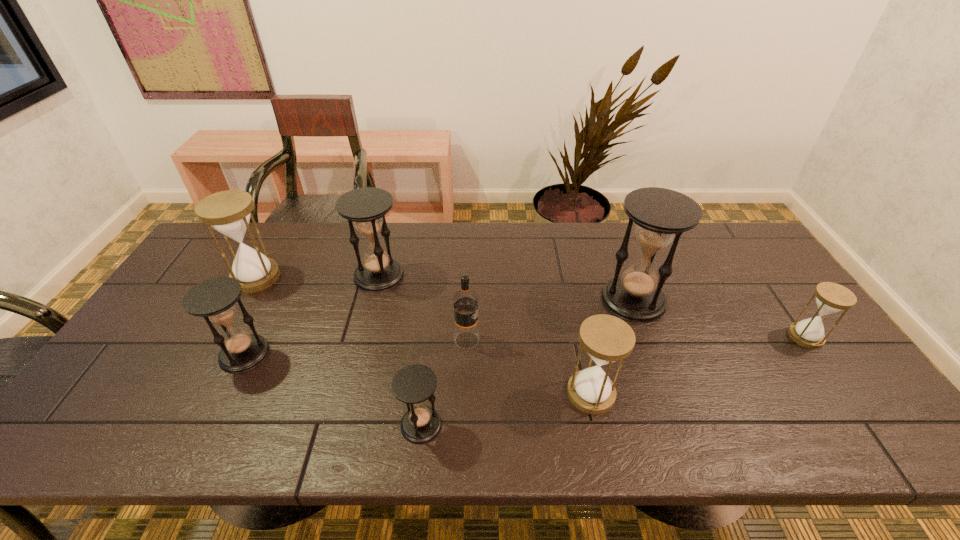
I want to click on free region at the far left corner, so click(x=204, y=254).

This screenshot has width=960, height=540. Find the location of `vacant space at the far right corner of the desktop`. vacant space at the far right corner of the desktop is located at coordinates coord(759,265).

Where is `vacant area that lies between the leftmost black hourglass and the smallest white hourglass`? The height and width of the screenshot is (540, 960). vacant area that lies between the leftmost black hourglass and the smallest white hourglass is located at coordinates (525, 346).

Where is `empty space that is in between the third smallest black hourglass and the tallest object`? The width and height of the screenshot is (960, 540). empty space that is in between the third smallest black hourglass and the tallest object is located at coordinates (506, 288).

You are a GUI agent. You are given a task and a screenshot of the screen. Output one action in this format:
    pyautogui.click(x=<x>, y=<y>)
    Task: Click on the free space that is in between the leftmost white hourglass and the fourth object from left to right
    
    Given the screenshot: What is the action you would take?
    pyautogui.click(x=339, y=351)

You are a GUI agent. You are given a task and a screenshot of the screen. Output one action in this format:
    pyautogui.click(x=<x>, y=<y>)
    Task: Click on the unoccupied area between the third black hourglass from left to right and the smallest white hourglass
    The image size is (960, 540).
    Given the screenshot: What is the action you would take?
    pyautogui.click(x=613, y=381)

Locate an element on the screen. The width and height of the screenshot is (960, 540). vacant space that is in between the nearest black hourglass and the leftmost white hourglass is located at coordinates (339, 351).

At what (x,y) coordinates should I click in order to perform the action: click on unoccupied area between the second smallest white hourglass and the farthest white hourglass. Please return your answer as a coordinate pair (x, y). Looking at the image, I should click on (423, 335).

The height and width of the screenshot is (540, 960). I want to click on free point between the tallest object and the fifth object from left to right, so click(550, 320).

You are a GUI agent. You are given a task and a screenshot of the screen. Output one action in this format:
    pyautogui.click(x=<x>, y=<y>)
    Task: Click on the free space between the leftmost black hourglass and the vodka
    The width and height of the screenshot is (960, 540).
    Given the screenshot: What is the action you would take?
    pyautogui.click(x=355, y=347)